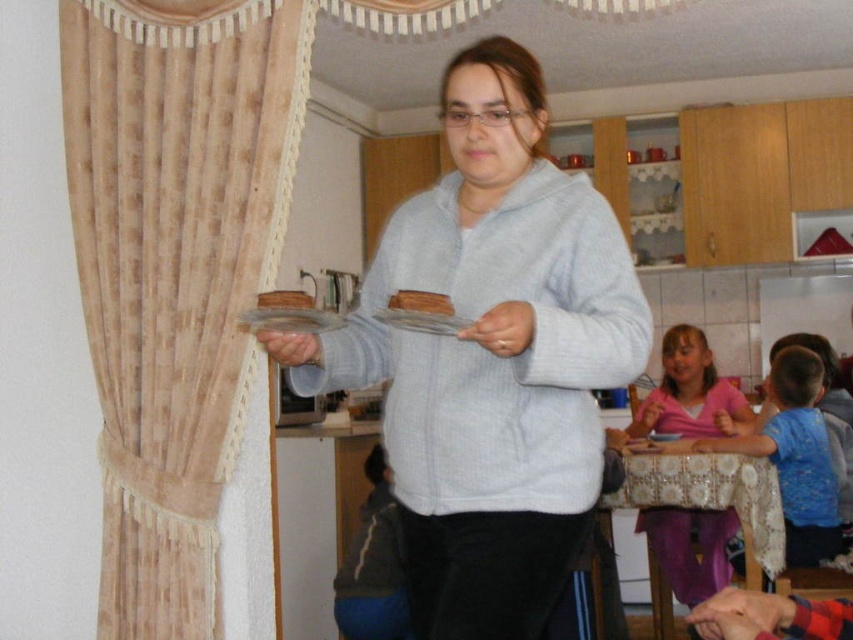
You are a guest at this party and want to sit closer to the table where the children are. Which direction should you move from the pink fabric shirt at lower right to get closer to the beige textured curtain at left?

To move closer to the beige textured curtain at left from the pink fabric shirt at lower right, you should move to the left since the beige textured curtain at left is positioned on the left side of the pink fabric shirt at lower right.

From the picture: You are a photographer trying to capture the best shot of the two points in the kitchen scene. The points are labeled as point 1 at coordinates point [686,353] and point 2 at coordinates point [277,294]. Which point will appear larger in your photo?

Point 1 at coordinates point [686,353] will appear larger in the photo because it is closer to the camera compared to point 2 at coordinates point [277,294].